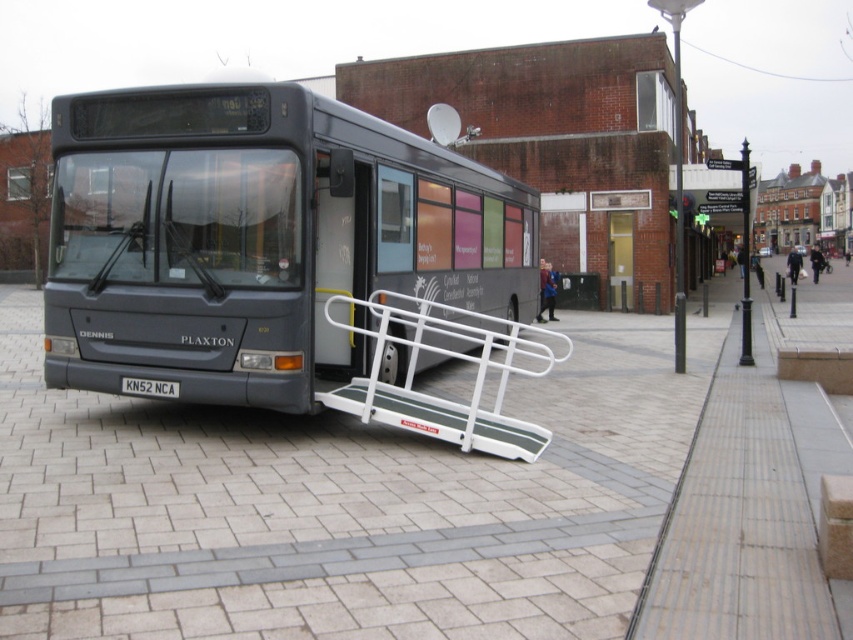
You are a passenger with a wheelchair who needs to board the Dennis Plaxton bus. The ramp is crucial for your access. Where is the white metallic ramp at center positioned relative to the bus?

The white metallic ramp at center is positioned at the rear door of the bus, as it is extended from there, providing accessibility for passengers like you.

You are a delivery person who needs to load a large package onto the white metallic ramp at center. The package is as big as the matte black bus at center. Can the ramp handle the size of the package?

The matte black bus at center is bigger than the white metallic ramp at center, so the ramp cannot handle the size of the package since it is smaller than the bus.